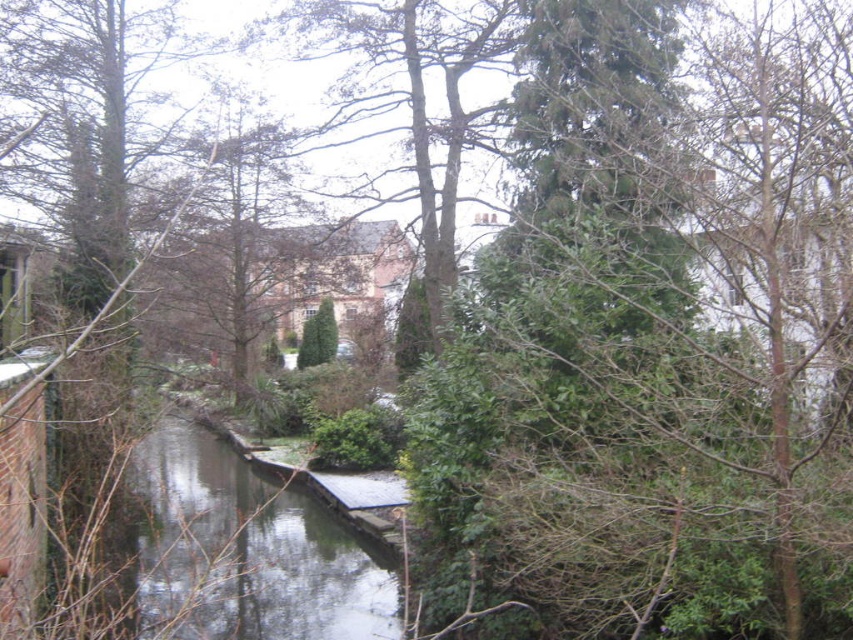
You are a hiker standing on the wooden bridge over the canal. You see a smooth bark tree at center and a green leafy tree at center. Which tree is closer to you?

The smooth bark tree at center is 17.76 meters away from the green leafy tree at center. Since both trees are at the center, their distance from the bridge is the same, so neither is closer.

You are a boat captain navigating a narrow canal. Your boat is 2 meters wide. You see the clear water at center and the green leafy tree at center in the image. Can your boat pass through the space between them? Please explain based on their widths.

The clear water at center is wider than the green leafy tree at center. Since the boat is 2 meters wide, it can pass through the space between them as the water is wider, providing enough space for the boat to navigate safely.

You are a photographer standing on the wooden bridge. You want to capture a photo of the clear water at center and the green leafy tree at center. Which one will appear closer to the camera in the photo?

The clear water at center is in front of the green leafy tree at center, so it will appear closer to the camera in the photo.